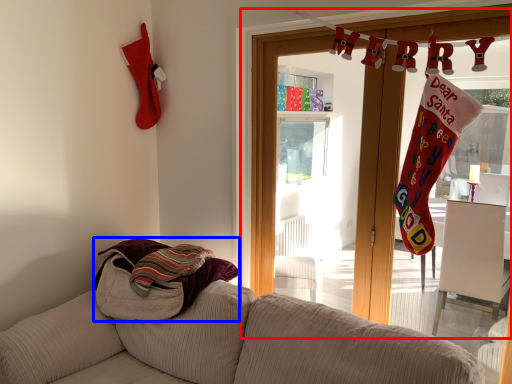
Question: Which object appears closest to the camera in this image, window frame (highlighted by a red box) or beach towel (highlighted by a blue box)?

Choices:
 (A) window frame
 (B) beach towel

Answer: (A)